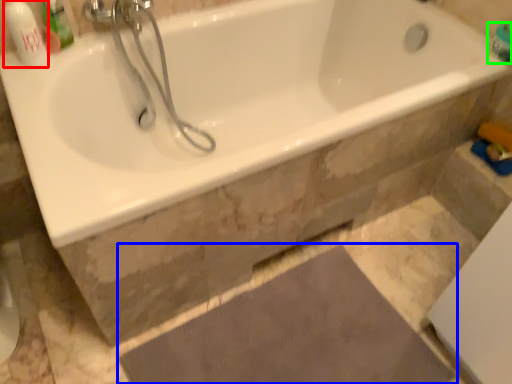
Question: Which is farther away from toiletry (highlighted by a red box)? doormat (highlighted by a blue box) or toiletry (highlighted by a green box)?

Choices:
 (A) doormat
 (B) toiletry

Answer: (B)